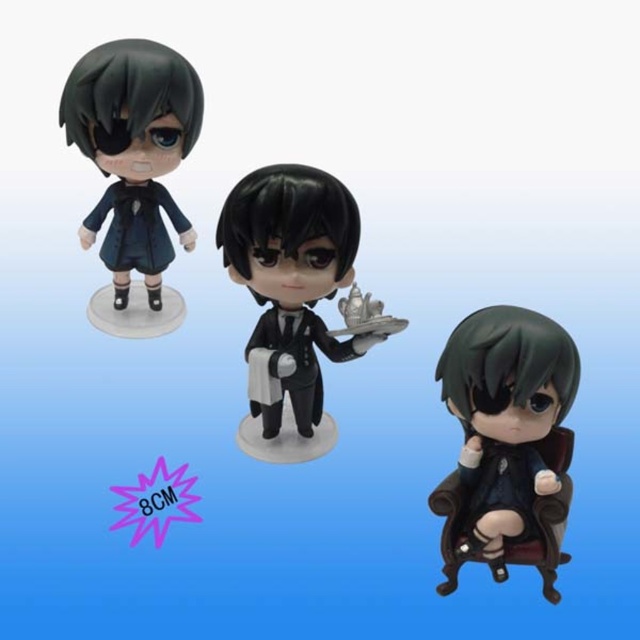
Question: Does satin black figurine at center lie in front of matte black doll at upper left?

Choices:
 (A) no
 (B) yes

Answer: (B)

Question: Among these objects, which one is farthest from the camera?

Choices:
 (A) matte black doll at upper left
 (B) matte black coat at upper left
 (C) matte black suit at center

Answer: (B)

Question: Which object appears farthest from the camera in this image?

Choices:
 (A) matte black coat at upper left
 (B) matte black doll at upper left
 (C) satin black figurine at center
 (D) matte black suit at center

Answer: (A)

Question: Does matte black doll at upper left lie behind matte black coat at upper left?

Choices:
 (A) yes
 (B) no

Answer: (B)

Question: Is matte black figurine at center wider than matte black suit at center?

Choices:
 (A) no
 (B) yes

Answer: (B)

Question: Which point is closer to the camera?

Choices:
 (A) (509, 522)
 (B) (262, 419)
 (C) (310, 196)

Answer: (A)